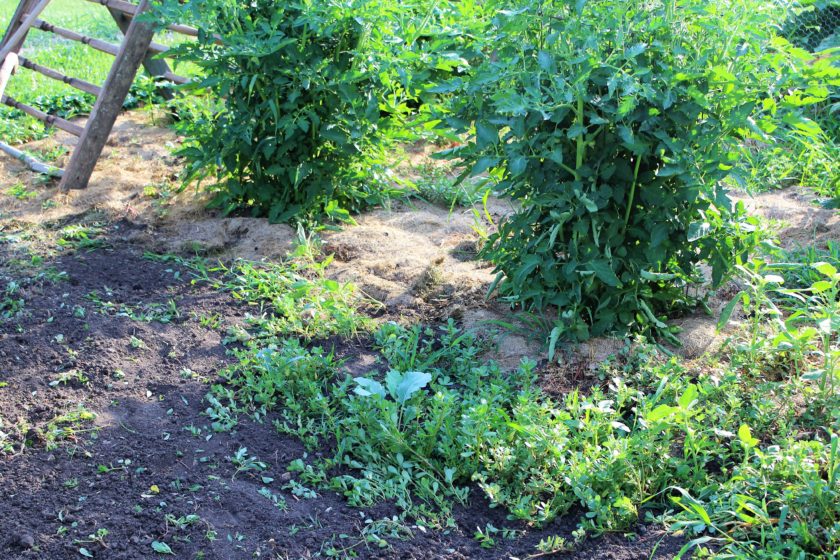
Locate an element on the screen. plant is located at coordinates (312, 94).